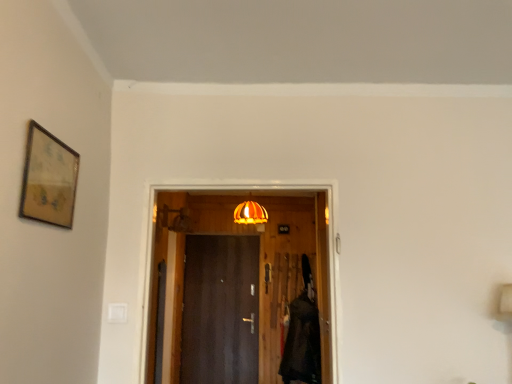
Question: Is the position of orange glass lampshade at center less distant than that of dark wood door at center, acting as the 1th door starting from the back?

Choices:
 (A) no
 (B) yes

Answer: (B)

Question: From a real-world perspective, does orange glass lampshade at center stand above dark wood door at center, arranged as the 2th door when viewed from the top?

Choices:
 (A) no
 (B) yes

Answer: (B)

Question: From the image's perspective, is orange glass lampshade at center below dark wood door at center, the first door from the bottom?

Choices:
 (A) no
 (B) yes

Answer: (A)

Question: Can you confirm if orange glass lampshade at center is smaller than dark wood door at center, the first door from the bottom?

Choices:
 (A) yes
 (B) no

Answer: (A)

Question: Is dark wood door at center, arranged as the 2th door when viewed from the top, completely or partially inside orange glass lampshade at center?

Choices:
 (A) yes
 (B) no

Answer: (B)

Question: Is orange glass lampshade at center oriented away from dark wood door at center, arranged as the 2th door when viewed from the top?

Choices:
 (A) no
 (B) yes

Answer: (A)

Question: Is the depth of wooden door at center, arranged as the 1th door when viewed from the front, greater than that of velvet black robe at right?

Choices:
 (A) no
 (B) yes

Answer: (A)

Question: From the image's perspective, is wooden door at center, arranged as the 1th door when viewed from the front, above velvet black robe at right?

Choices:
 (A) no
 (B) yes

Answer: (B)

Question: Considering the relative sizes of wooden door at center, the second door when ordered from bottom to top, and velvet black robe at right in the image provided, is wooden door at center, the second door when ordered from bottom to top, shorter than velvet black robe at right?

Choices:
 (A) yes
 (B) no

Answer: (A)

Question: Is velvet black robe at right a part of wooden door at center, the second door from the back?

Choices:
 (A) no
 (B) yes

Answer: (A)

Question: Does wooden door at center, which ranks as the first door in top-to-bottom order, turn towards velvet black robe at right?

Choices:
 (A) yes
 (B) no

Answer: (B)

Question: Is wooden door at center, which ranks as the first door in top-to-bottom order, in front of velvet black robe at right?

Choices:
 (A) no
 (B) yes

Answer: (B)

Question: Is dark wood door at center, acting as the 1th door starting from the back, at the right side of velvet black robe at right?

Choices:
 (A) yes
 (B) no

Answer: (B)